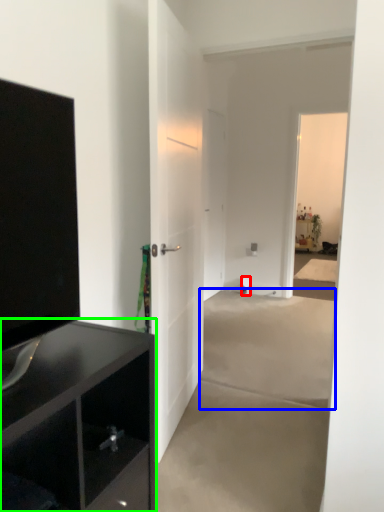
Question: Which object is positioned closest to toilet paper (highlighted by a red box)? Select from concrete (highlighted by a blue box) and cabinetry (highlighted by a green box).

Choices:
 (A) concrete
 (B) cabinetry

Answer: (A)